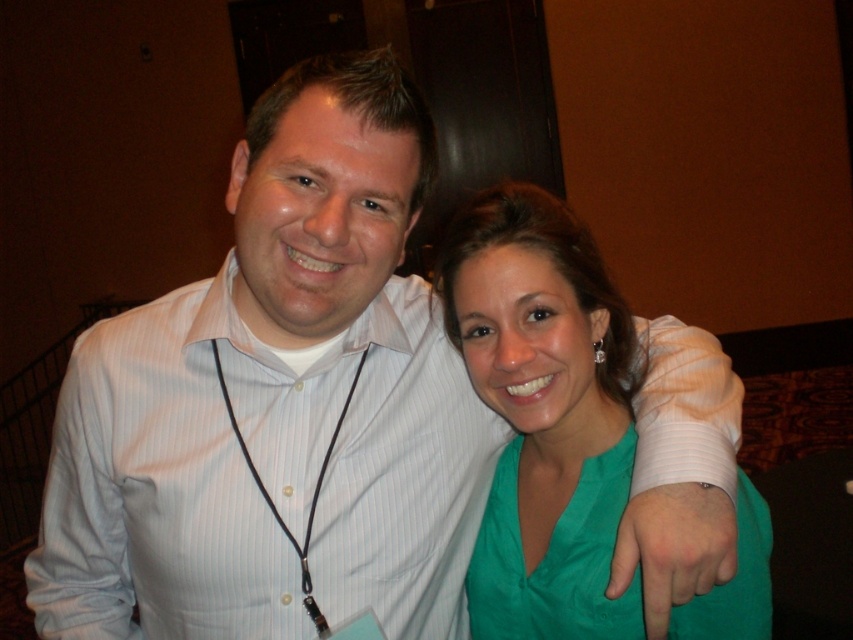
Is the position of white striped shirt at center more distant than that of white bandage at upper right?

Yes, it is behind white bandage at upper right.

Is white striped shirt at center smaller than white bandage at upper right?

No, white striped shirt at center is not smaller than white bandage at upper right.

Where is `white striped shirt at center`? This screenshot has width=853, height=640. white striped shirt at center is located at coordinates (260, 476).

Can you confirm if green satin blouse at center is taller than green satin dress at center?

Indeed, green satin blouse at center has a greater height compared to green satin dress at center.

What do you see at coordinates (544, 413) in the screenshot?
I see `green satin blouse at center` at bounding box center [544, 413].

This screenshot has height=640, width=853. Identify the location of green satin blouse at center. (544, 413).

Which of these two, white bandage at upper right or green satin hand at center, stands shorter?

green satin hand at center

Between white bandage at upper right and green satin hand at center, which one is positioned higher?

white bandage at upper right is above.

Which is behind, point (656, 385) or point (662, 516)?

The point (656, 385) is behind.

Find the location of a particular element. This screenshot has width=853, height=640. white bandage at upper right is located at coordinates (679, 472).